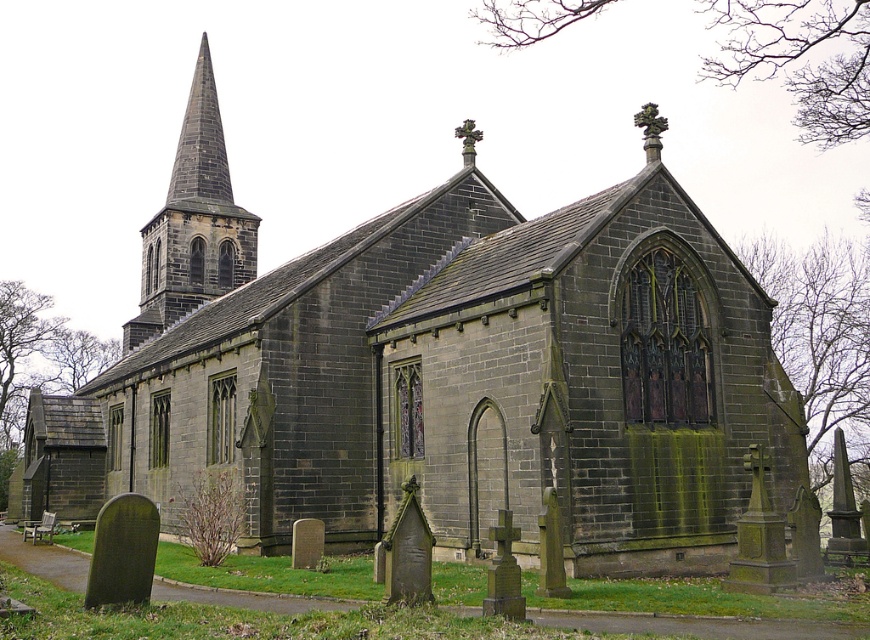
This screenshot has height=640, width=870. Describe the element at coordinates (193, 221) in the screenshot. I see `dark gray stone steeple at upper left` at that location.

Does point (169, 320) lie in front of point (463, 125)?

No, it is behind (463, 125).

This screenshot has width=870, height=640. Find the location of `dark gray stone steeple at upper left`. dark gray stone steeple at upper left is located at coordinates (193, 221).